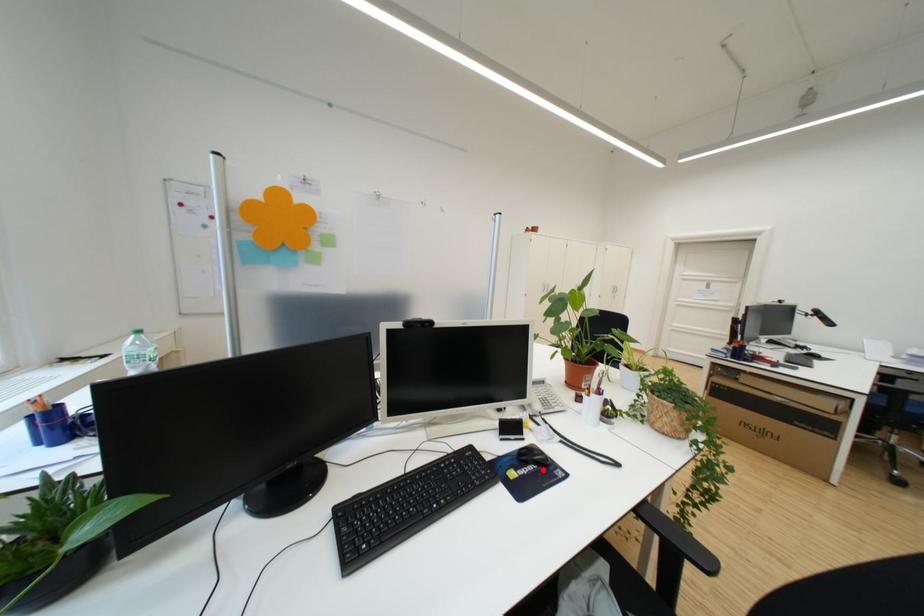
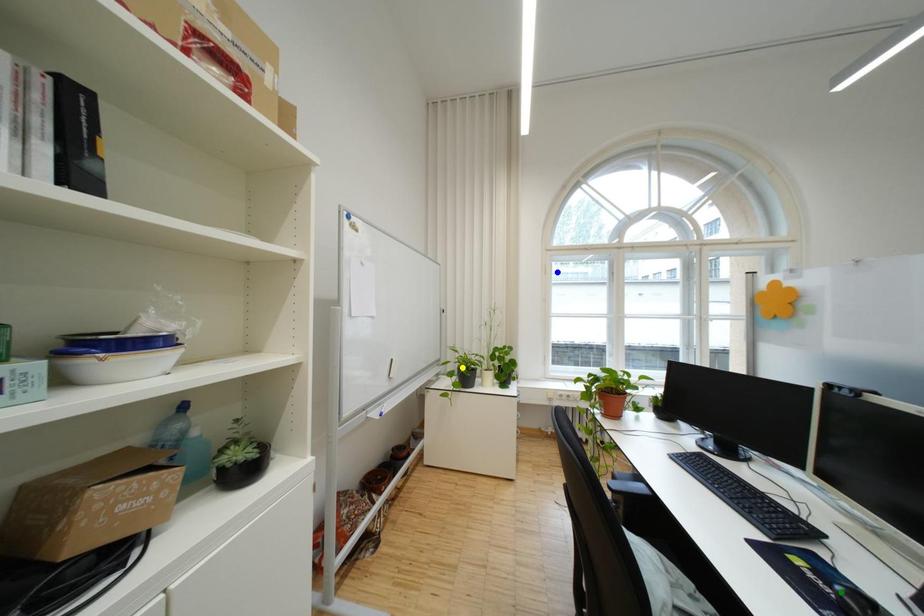
Question: I am providing you with two images of the same scene from different viewpoints. A red point is marked on the first image. You are given multiple points on the second image. Which spot in image 2 lines up with the point in image 1?

Choices:
 (A) blue point
 (B) yellow point
 (C) green point

Answer: (C)